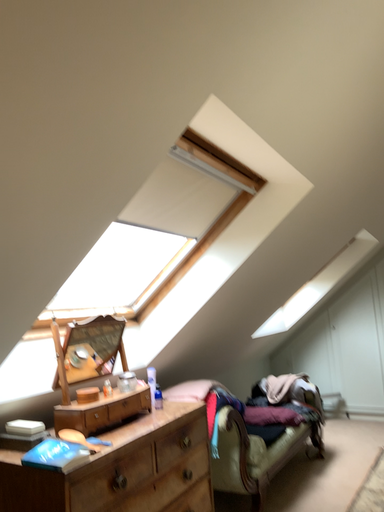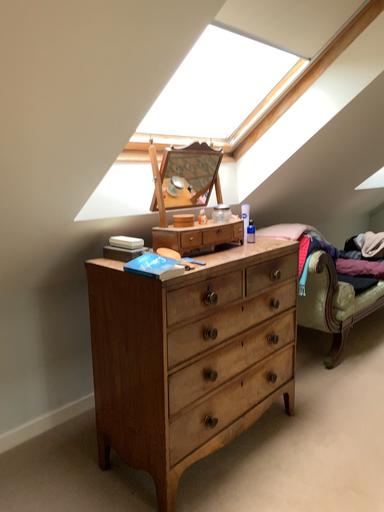
Question: Which way did the camera rotate in the video?

Choices:
 (A) rotated right
 (B) rotated left

Answer: (B)